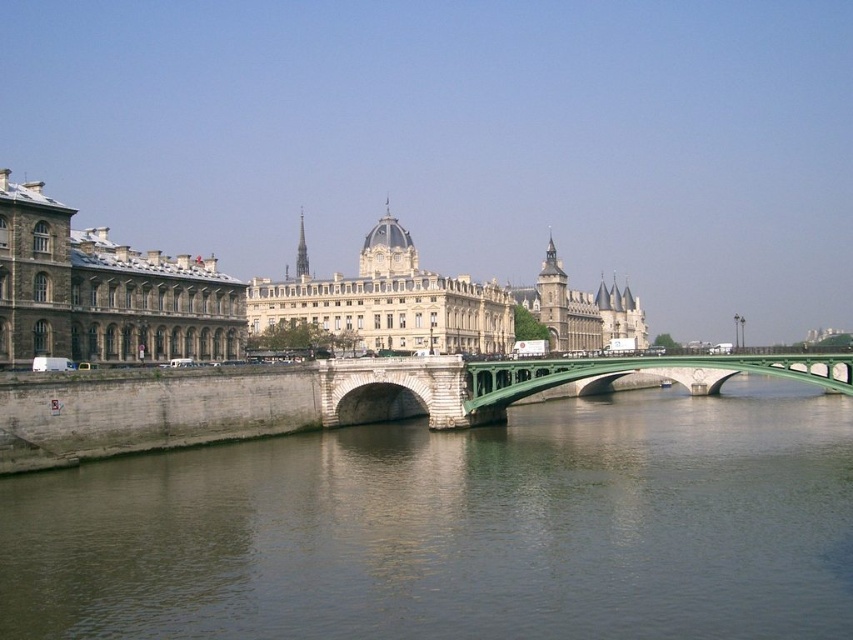
Who is positioned more to the right, green stone river at center or stone building at left?

green stone river at center

Between green stone river at center and stone building at left, which one is positioned higher?

stone building at left is above.

Where is `green stone river at center`? The height and width of the screenshot is (640, 853). green stone river at center is located at coordinates (457, 529).

Find the location of a particular element. This screenshot has height=640, width=853. green stone river at center is located at coordinates (457, 529).

Measure the distance between green stone river at center and camera.

139.22 feet

Is green stone river at center smaller than beige stone building at center?

Yes.

Is point (289, 570) farther from viewer compared to point (367, 296)?

No, it is not.

Locate an element on the screen. The width and height of the screenshot is (853, 640). green stone river at center is located at coordinates (457, 529).

Does stone building at left lie behind green stone bridge at center?

No, it is in front of green stone bridge at center.

Identify the location of stone building at left. This screenshot has width=853, height=640. (103, 291).